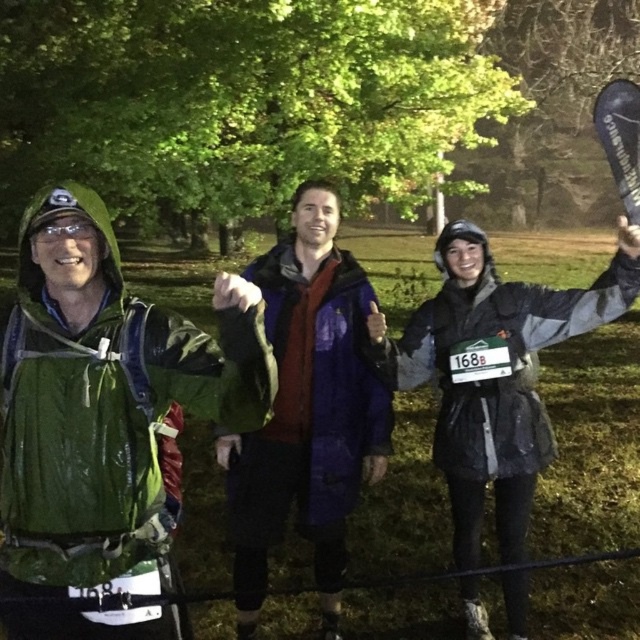
You are organizing a group photo and need to arrange the purple matte jacket at center and gray matte jacket at center so that both are visible in the frame. Based on their sizes, which should be placed closer to the camera to ensure both are fully visible?

The purple matte jacket at center occupies less space than the gray matte jacket at center, so placing the purple matte jacket at center closer to the camera will help ensure both are fully visible in the photo.

You are a photographer trying to capture a group photo of the purple matte jacket at center and the gray matte jacket at center. If your camera has a maximum focus range of 17 inches, will you be able to capture both subjects clearly in the same frame?

The distance between the purple matte jacket at center and gray matte jacket at center is 17.49 inches, which exceeds the camera maximum focus range of 17 inches. Therefore, the photographer cannot capture both subjects clearly in the same frame.